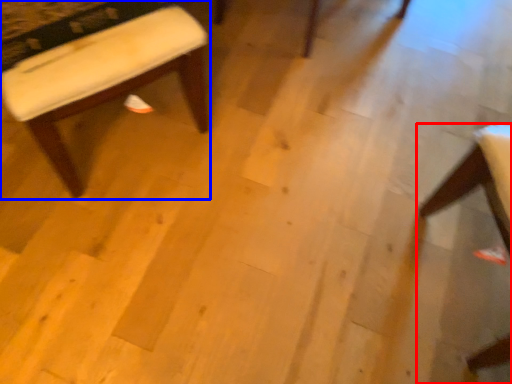
Question: Which point is further to the camera, chair (highlighted by a red box) or stool (highlighted by a blue box)?

Choices:
 (A) chair
 (B) stool

Answer: (B)